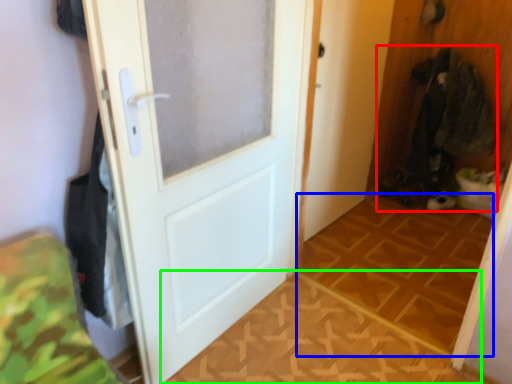
Question: Considering the real-world distances, which object is farthest from laundry (highlighted by a red box)? tile (highlighted by a blue box) or tile (highlighted by a green box)?

Choices:
 (A) tile
 (B) tile

Answer: (B)